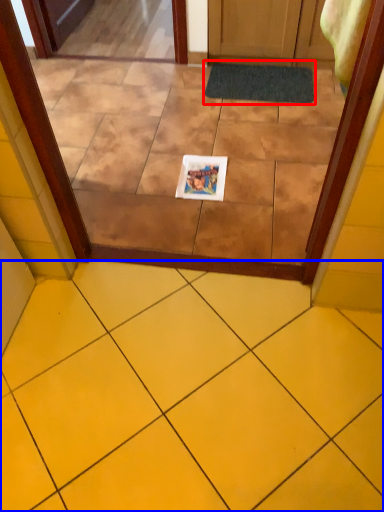
Question: Among these objects, which one is nearest to the camera, bath mat (highlighted by a red box) or ceramic tile (highlighted by a blue box)?

Choices:
 (A) bath mat
 (B) ceramic tile

Answer: (B)